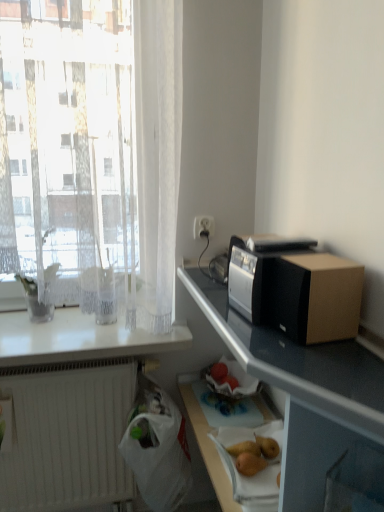
Question: Is brown cardboard box at right facing towards white glossy countertop at upper left?

Choices:
 (A) yes
 (B) no

Answer: (B)

Question: Can you confirm if brown cardboard box at right is shorter than white glossy countertop at upper left?

Choices:
 (A) no
 (B) yes

Answer: (A)

Question: Is brown cardboard box at right taller than white glossy countertop at upper left?

Choices:
 (A) no
 (B) yes

Answer: (B)

Question: Are brown cardboard box at right and white glossy countertop at upper left making contact?

Choices:
 (A) no
 (B) yes

Answer: (A)

Question: From a real-world perspective, is brown cardboard box at right under white glossy countertop at upper left?

Choices:
 (A) yes
 (B) no

Answer: (B)

Question: Considering the positions of brown cardboard box at right and white plastic bag at lower center in the image, is brown cardboard box at right taller or shorter than white plastic bag at lower center?

Choices:
 (A) short
 (B) tall

Answer: (A)

Question: Looking at the image, does brown cardboard box at right seem bigger or smaller compared to white plastic bag at lower center?

Choices:
 (A) small
 (B) big

Answer: (A)

Question: From the image's perspective, is brown cardboard box at right positioned above or below white plastic bag at lower center?

Choices:
 (A) below
 (B) above

Answer: (B)

Question: From a real-world perspective, is brown cardboard box at right positioned above or below white plastic bag at lower center?

Choices:
 (A) above
 (B) below

Answer: (A)

Question: In the image, is brown cardboard box at right positioned in front of or behind smooth brown pear at lower center?

Choices:
 (A) behind
 (B) front

Answer: (B)

Question: In terms of width, does brown cardboard box at right look wider or thinner when compared to smooth brown pear at lower center?

Choices:
 (A) thin
 (B) wide

Answer: (B)

Question: Does point (284, 274) appear closer or farther from the camera than point (274, 446)?

Choices:
 (A) closer
 (B) farther

Answer: (A)

Question: Based on their sizes in the image, would you say brown cardboard box at right is bigger or smaller than smooth brown pear at lower center?

Choices:
 (A) big
 (B) small

Answer: (A)

Question: Considering their positions, is white matte radiator at lower left located in front of or behind white plastic bag at lower center?

Choices:
 (A) front
 (B) behind

Answer: (B)

Question: Considering the relative positions of white matte radiator at lower left and white plastic bag at lower center in the image provided, is white matte radiator at lower left to the left or to the right of white plastic bag at lower center?

Choices:
 (A) left
 (B) right

Answer: (A)